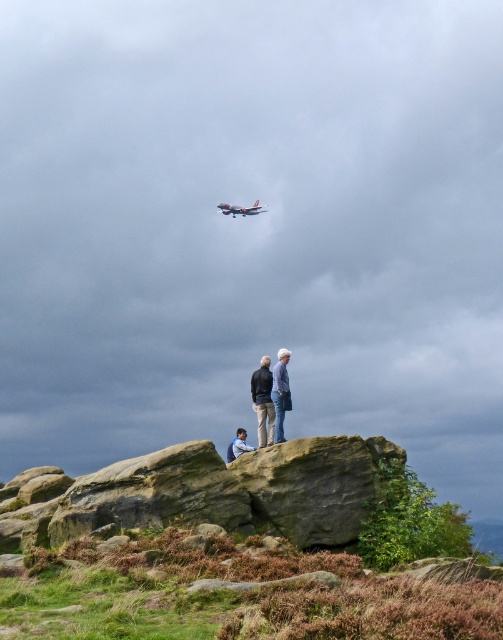
Which of these two, green mossy rock at center or blue denim jacket at lower center, stands shorter?

Standing shorter between the two is blue denim jacket at lower center.

Where is `green mossy rock at center`? This screenshot has height=640, width=503. green mossy rock at center is located at coordinates (224, 552).

Is green mossy rock at center bigger than light blue denim jeans at center?

Correct, green mossy rock at center is larger in size than light blue denim jeans at center.

Who is higher up, green mossy rock at center or light blue denim jeans at center?

light blue denim jeans at center is above.

Is point (360, 481) in front of point (276, 365)?

Yes, point (360, 481) is closer to viewer.

This screenshot has width=503, height=640. I want to click on green mossy rock at center, so click(x=224, y=552).

This screenshot has width=503, height=640. What are the coordinates of `light blue denim jacket at center` in the screenshot? It's located at (281, 394).

Is light blue denim jacket at center positioned in front of blue denim jacket at lower center?

Yes, it is.

Who is more forward, (277, 412) or (239, 449)?

Point (277, 412)

Find the location of `light blue denim jacket at center`. light blue denim jacket at center is located at coordinates (281, 394).